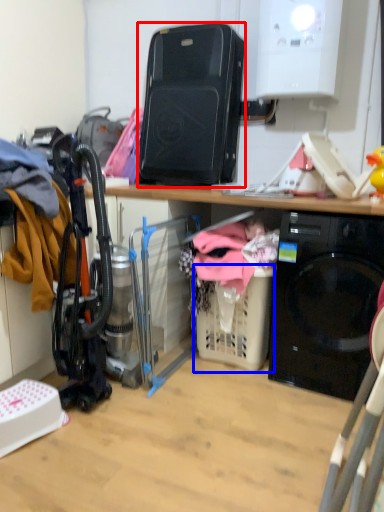
Question: Which object is closer to the camera taking this photo, appliance (highlighted by a red box) or basket (highlighted by a blue box)?

Choices:
 (A) appliance
 (B) basket

Answer: (B)